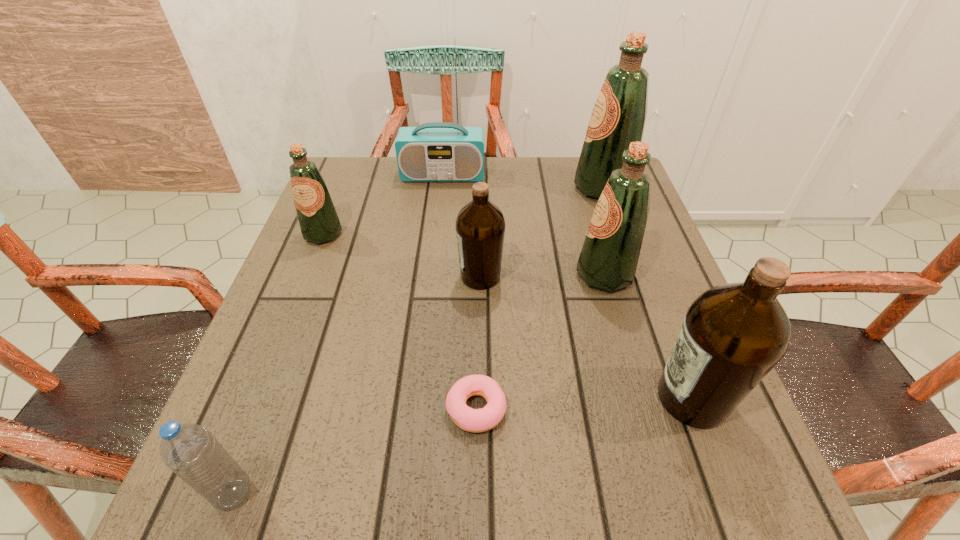
Where is `the fourth closest object to the nearest object`? Image resolution: width=960 pixels, height=540 pixels. the fourth closest object to the nearest object is located at coordinates (733, 335).

Locate which object is the third closest to the nearer brown olive oil. Please provide its 2D coordinates. Your answer should be formatted as a tuple, i.e. [(x, y)], where the tuple contains the x and y coordinates of a point satisfying the conditions above.

[(480, 225)]

Identify the location of olive oil identified as the third closest to the blue water bottle. (733, 335).

The height and width of the screenshot is (540, 960). Identify the location of the fourth closest olive oil to the light radio receiver. (609, 257).

Identify the location of the closest green olive oil to the shortest object. The image size is (960, 540). (609, 257).

Locate which green olive oil is the second closest to the bigger brown olive oil. Please provide its 2D coordinates. Your answer should be formatted as a tuple, i.e. [(x, y)], where the tuple contains the x and y coordinates of a point satisfying the conditions above.

[(618, 118)]

Find the location of a particular element. Image resolution: width=960 pixels, height=540 pixels. vacant position in the image that satisfies the following two spatial constraints: 1. on the front-facing side of the leftmost olive oil; 2. on the left side of the doughnut is located at coordinates (254, 409).